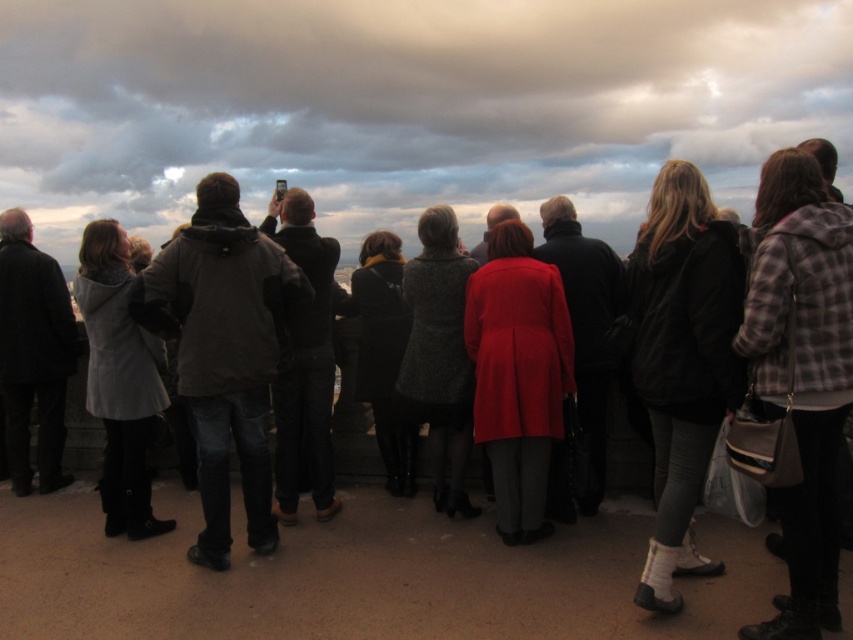
Can you confirm if plaid wool jacket at right is positioned above dark gray jacket at center?

Yes, plaid wool jacket at right is above dark gray jacket at center.

Locate an element on the screen. The height and width of the screenshot is (640, 853). plaid wool jacket at right is located at coordinates (801, 372).

Does point (776, 284) come in front of point (154, 276)?

That is True.

Locate an element on the screen. This screenshot has height=640, width=853. plaid wool jacket at right is located at coordinates (801, 372).

Measure the distance between dark gray jacket at center and matte red coat at center.

dark gray jacket at center is 5.27 feet from matte red coat at center.

Where is `dark gray jacket at center`? dark gray jacket at center is located at coordinates (224, 352).

In order to click on plaid wool jacket at right in this screenshot , I will do `click(801, 372)`.

Where is `plaid wool jacket at right`? plaid wool jacket at right is located at coordinates (801, 372).

Find the location of a particular element. The height and width of the screenshot is (640, 853). plaid wool jacket at right is located at coordinates (801, 372).